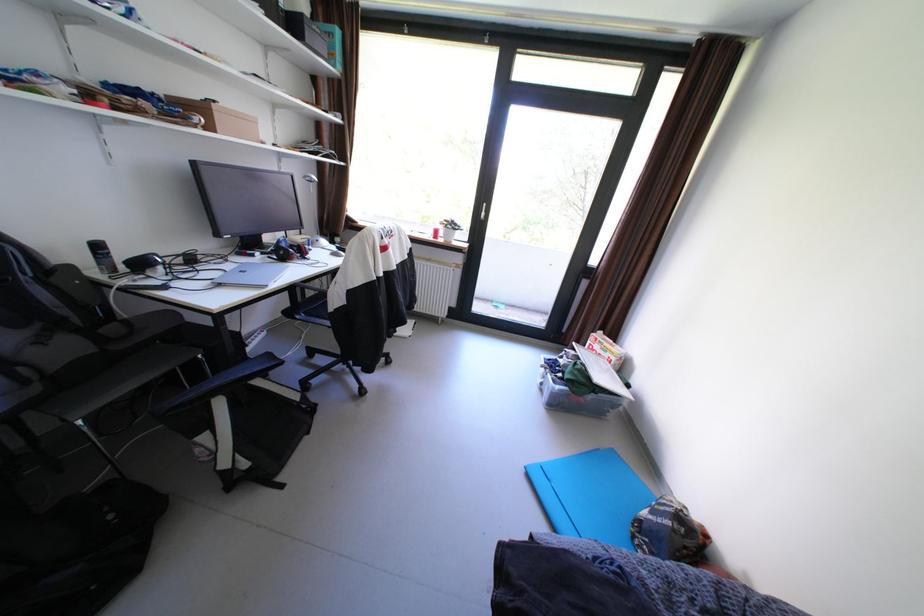
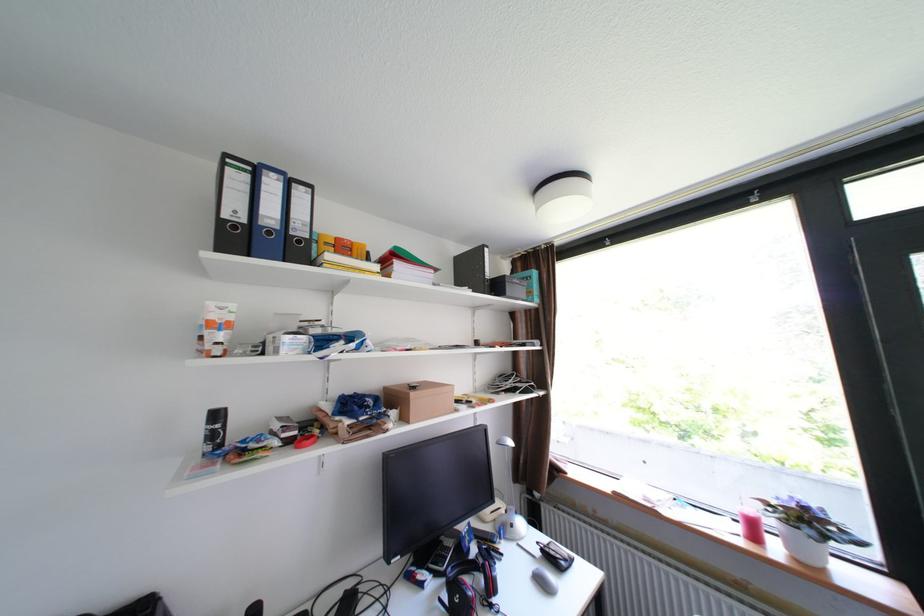
Locate, in the second image, the point that corresponds to (220,128) in the first image.

(415, 419)